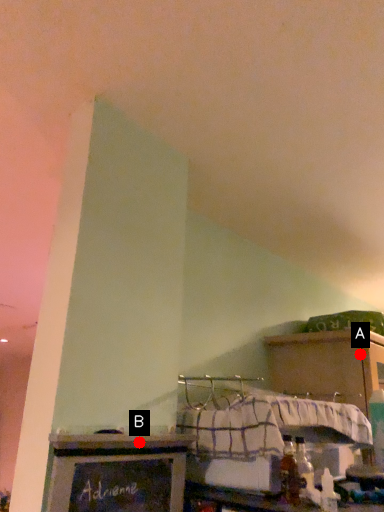
Question: Two points are circled on the image, labeled by A and B beside each circle. Which point is farther from the camera taking this photo?

Choices:
 (A) A is further
 (B) B is further

Answer: (A)